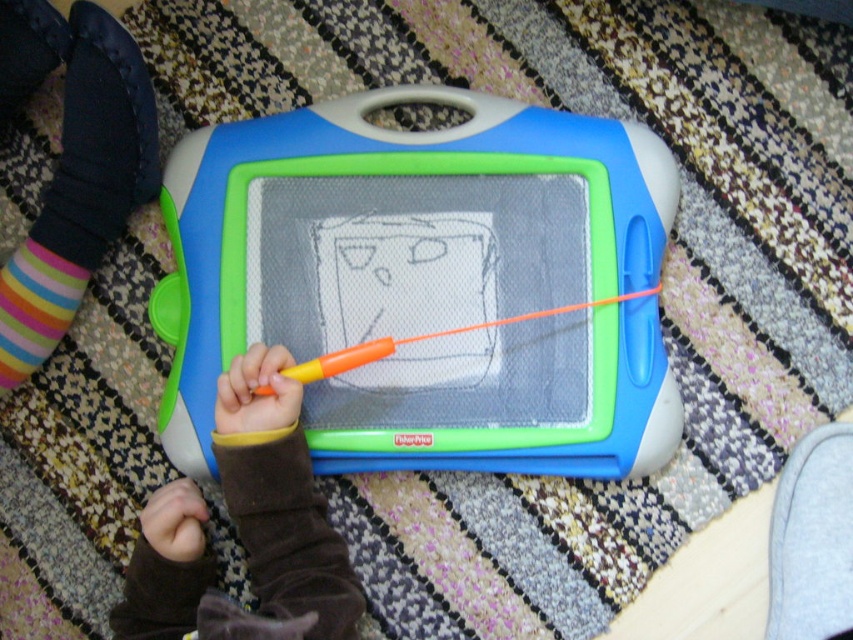
Who is taller, matte plastic drawing board at center or brown velvet hand at center?

Standing taller between the two is matte plastic drawing board at center.

Who is higher up, matte plastic drawing board at center or brown velvet hand at center?

matte plastic drawing board at center is higher up.

Identify the location of matte plastic drawing board at center. (392, 230).

This screenshot has height=640, width=853. I want to click on matte plastic drawing board at center, so click(x=392, y=230).

Is matte plastic drawing board at center positioned in front of orange plastic pen at center?

No.

Describe the element at coordinates (392, 230) in the screenshot. The image size is (853, 640). I see `matte plastic drawing board at center` at that location.

Locate an element on the screen. Image resolution: width=853 pixels, height=640 pixels. matte plastic drawing board at center is located at coordinates (392, 230).

Looking at this image, does brown velvet hand at center appear under multicolored striped sock at lower left?

Yes, brown velvet hand at center is below multicolored striped sock at lower left.

Between brown velvet hand at center and multicolored striped sock at lower left, which one is positioned higher?

multicolored striped sock at lower left

Who is more distant from viewer, (270, 369) or (42, 337)?

Positioned behind is point (42, 337).

Identify the location of brown velvet hand at center. (244, 529).